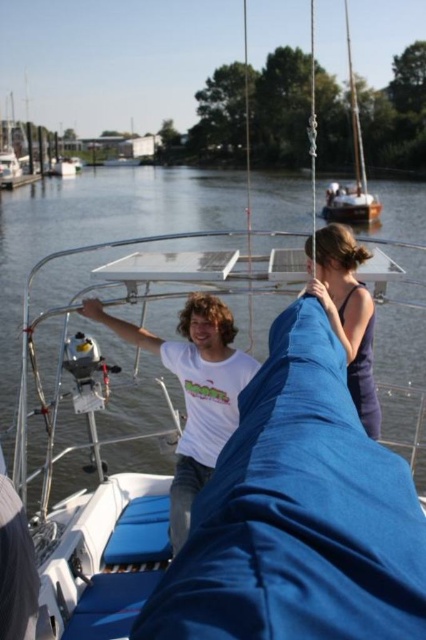
You are on a boat and see two sailboats in the distance. The blue fabric sailboat at center and the wooden sailboat at upper right. Which one is closer to you?

The blue fabric sailboat at center is closer to you because it is positioned under the wooden sailboat at upper right, indicating it is in front.

You are on a boat and see two sailboats in the distance. The blue fabric sailboat at center and the wooden sailboat at upper right. Which one is positioned to the left?

The blue fabric sailboat at center is positioned to the left of the wooden sailboat at upper right.